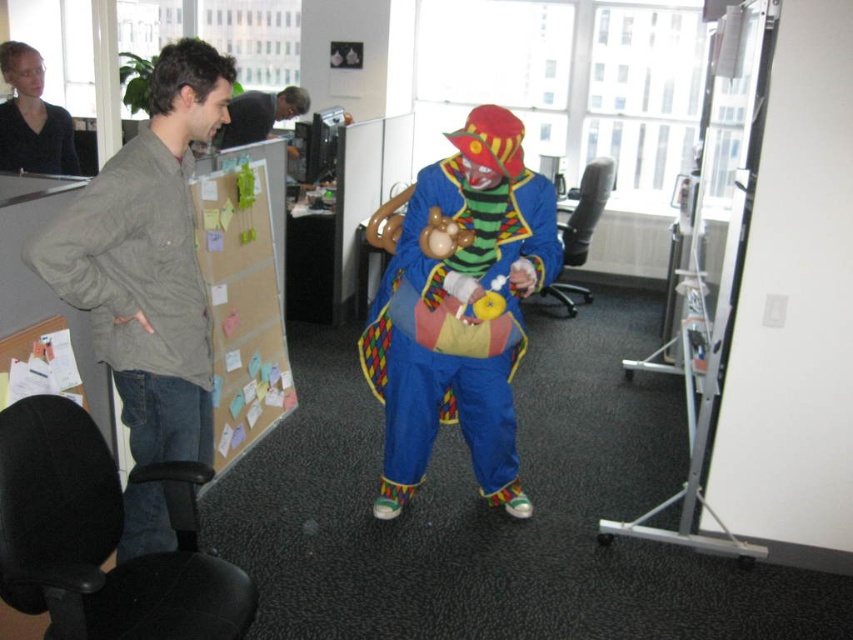
In the office scene with the clown and the observer, where are the matte gray jacket at left and the matte black shirt at upper left positioned relative to each other? Specifically, which one is located to the right?

The matte gray jacket at left is positioned to the right of the matte black shirt at upper left.

What are the coordinates of the matte blue clown costume at center in the image?

The matte blue clown costume at center is located at coordinates point (457, 326).